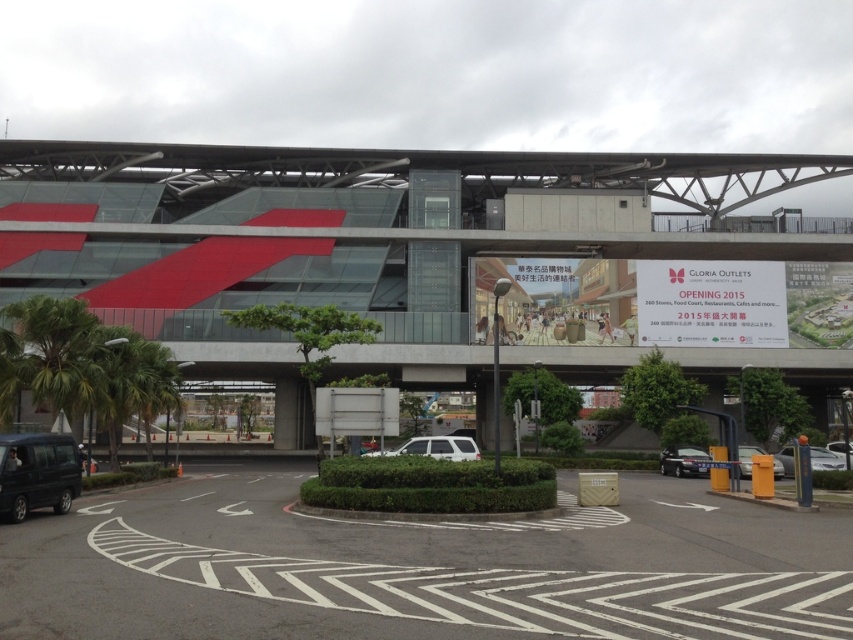
You are standing in front of the Gloria Outlets building and want to take a photo that includes both the point at coordinates point (61, 442) and the point at coordinates point (674, 472). Which point will appear closer to the bottom of the photo?

The point at coordinates point (674, 472) will appear closer to the bottom of the photo because it is farther from the camera compared to point (61, 442).

You are a delivery driver who needs to park your matte black van at lower left in the parking lot. The parking space at point (38, 474) is marked with a zigzag. Is this a suitable parking spot for your vehicle?

The parking space at point (38, 474) is marked with a zigzag, which typically indicates no parking. Therefore, it is not suitable to park the matte black van at lower left there.

You are a delivery driver arriving at the Gloria Outlets. You see the red glass building at center and the silver metallic sedan at lower right. Which object is larger in size?

The red glass building at center is bigger than the silver metallic sedan at lower right.